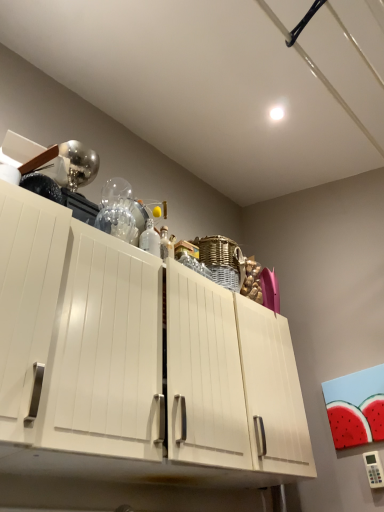
Question: From the image's perspective, is white glossy cabinet at center located above or below white glossy bottle at upper center?

Choices:
 (A) below
 (B) above

Answer: (A)

Question: Considering the positions of white glossy cabinet at center and white glossy bottle at upper center in the image, is white glossy cabinet at center bigger or smaller than white glossy bottle at upper center?

Choices:
 (A) big
 (B) small

Answer: (A)

Question: From a real-world perspective, is white glossy cabinet at center physically located above or below white glossy bottle at upper center?

Choices:
 (A) above
 (B) below

Answer: (B)

Question: Is point (142, 242) positioned closer to the camera than point (157, 346)?

Choices:
 (A) closer
 (B) farther

Answer: (B)

Question: Relative to white glossy cabinet at center, is white glossy bottle at upper center in front or behind?

Choices:
 (A) behind
 (B) front

Answer: (A)

Question: Based on their sizes in the image, would you say white glossy bottle at upper center is bigger or smaller than white glossy cabinet at center?

Choices:
 (A) big
 (B) small

Answer: (B)

Question: In terms of width, does white glossy bottle at upper center look wider or thinner when compared to white glossy cabinet at center?

Choices:
 (A) thin
 (B) wide

Answer: (A)